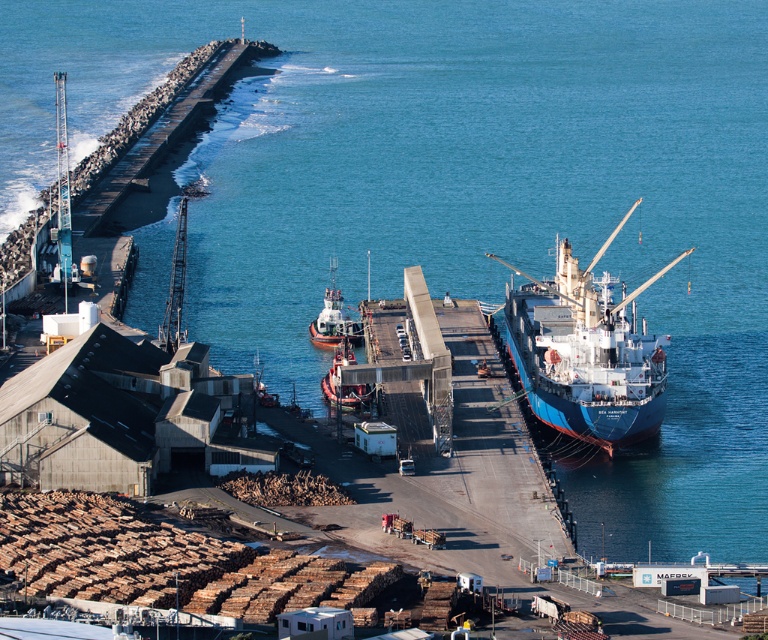
You are a crane operator on the cargo crane at the pier. You need to lower a heavy container onto the metallic gray tugboat at center. The container is 25 meters long. Can you safely lower it without hitting the smooth white tugboat at center?

The distance between the metallic gray tugboat at center and the smooth white tugboat at center is 24.95 meters. Since the container is 25 meters long, lowering it would cause it to extend beyond the space between them, resulting in a collision. Therefore, it is not safe to proceed.

In the scene shown: You are standing at the jetty and want to reach the point marked at coordinates point (634, 298). If your walking speed is 1.5 meters per second, how long will it take you to reach that point?

The distance between you and point (634, 298) is 210.89 meters. At a walking speed of 1.5 meters per second, it will take approximately 140.59 seconds, or about 2 minutes and 21 seconds, to reach the point.